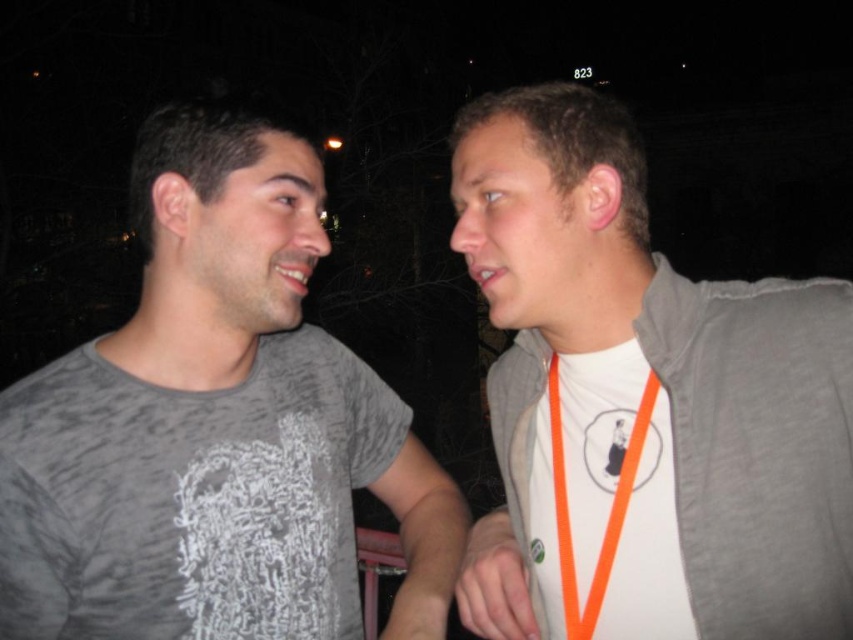
Does gray matte t-shirt at left have a lesser height compared to gray matte neck at center?

Incorrect, gray matte t-shirt at left's height does not fall short of gray matte neck at center's.

Is gray matte t-shirt at left to the left of gray matte neck at center from the viewer's perspective?

In fact, gray matte t-shirt at left is to the right of gray matte neck at center.

The image size is (853, 640). What do you see at coordinates (215, 426) in the screenshot?
I see `gray matte t-shirt at left` at bounding box center [215, 426].

Find the location of a particular element. gray matte t-shirt at left is located at coordinates (215, 426).

Is point (717, 492) less distant than point (216, 296)?

That is True.

Is point (544, 609) in front of point (161, 349)?

That is False.

The image size is (853, 640). Find the location of `white fabric shirt at right`. white fabric shirt at right is located at coordinates (642, 403).

Who is taller, white fabric shirt at right or gray matte t-shirt at left?

gray matte t-shirt at left

Can you confirm if white fabric shirt at right is thinner than gray matte t-shirt at left?

Yes.

Describe the element at coordinates (642, 403) in the screenshot. This screenshot has width=853, height=640. I see `white fabric shirt at right` at that location.

You are a GUI agent. You are given a task and a screenshot of the screen. Output one action in this format:
    pyautogui.click(x=<x>, y=<y>)
    Task: Click on the white fabric shirt at right
    The width and height of the screenshot is (853, 640).
    Given the screenshot: What is the action you would take?
    pyautogui.click(x=642, y=403)